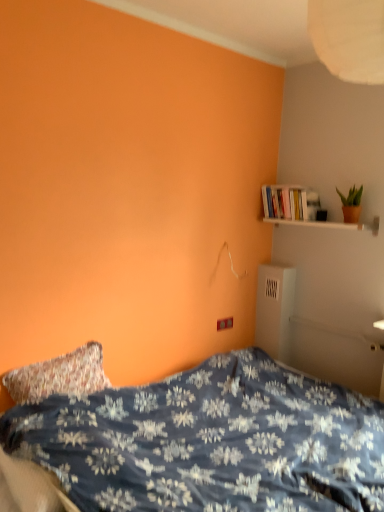
Question: Is green matte plant at upper right positioned far away from white wooden shelf at upper right?

Choices:
 (A) yes
 (B) no

Answer: (B)

Question: From a real-world perspective, is green matte plant at upper right beneath white wooden shelf at upper right?

Choices:
 (A) no
 (B) yes

Answer: (A)

Question: From the image's perspective, is green matte plant at upper right located beneath white wooden shelf at upper right?

Choices:
 (A) no
 (B) yes

Answer: (A)

Question: Is green matte plant at upper right not inside white wooden shelf at upper right?

Choices:
 (A) no
 (B) yes

Answer: (B)

Question: Is green matte plant at upper right wider than white wooden shelf at upper right?

Choices:
 (A) yes
 (B) no

Answer: (B)

Question: Looking at their shapes, would you say green matte plant at upper right is wider or thinner than white wooden shelf at upper right?

Choices:
 (A) thin
 (B) wide

Answer: (A)

Question: From the image's perspective, relative to white wooden shelf at upper right, is green matte plant at upper right above or below?

Choices:
 (A) above
 (B) below

Answer: (A)

Question: Considering the relative positions of green matte plant at upper right and white wooden shelf at upper right in the image provided, is green matte plant at upper right to the left or to the right of white wooden shelf at upper right?

Choices:
 (A) right
 (B) left

Answer: (A)

Question: Is point (342, 195) positioned closer to the camera than point (274, 223)?

Choices:
 (A) farther
 (B) closer

Answer: (B)

Question: From the image's perspective, is white wooden shelf at upper right located above or below white glossy bookshelf at upper right?

Choices:
 (A) above
 (B) below

Answer: (B)

Question: Considering the positions of point (271, 223) and point (284, 216), is point (271, 223) closer or farther from the camera than point (284, 216)?

Choices:
 (A) farther
 (B) closer

Answer: (A)

Question: From a real-world perspective, is white wooden shelf at upper right positioned above or below white glossy bookshelf at upper right?

Choices:
 (A) above
 (B) below

Answer: (B)

Question: Is white wooden shelf at upper right bigger or smaller than white glossy bookshelf at upper right?

Choices:
 (A) big
 (B) small

Answer: (B)

Question: From the image's perspective, is blue floral fabric bed at lower left positioned above or below white wooden shelf at upper right?

Choices:
 (A) below
 (B) above

Answer: (A)

Question: Looking at their shapes, would you say blue floral fabric bed at lower left is wider or thinner than white wooden shelf at upper right?

Choices:
 (A) thin
 (B) wide

Answer: (B)